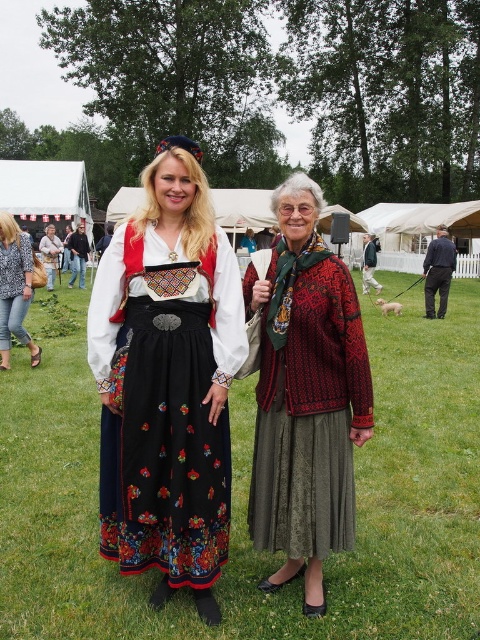
Question: Based on their relative distances, which object is nearer to the denim jeans at lower left?

Choices:
 (A) knitted sweater at center
 (B) matte black dress at center

Answer: (B)

Question: Which object is the farthest from the knitted wool sweater at center?

Choices:
 (A) knitted sweater at center
 (B) floral-patterned fabric dress at center
 (C) matte black skirt at center

Answer: (C)

Question: Is green grass at center closer to camera compared to knitted sweater at center?

Choices:
 (A) yes
 (B) no

Answer: (A)

Question: Which of the following is the closest to the observer?

Choices:
 (A) (46, 240)
 (B) (296, 484)
 (C) (396, 397)

Answer: (B)

Question: Observing the image, what is the correct spatial positioning of knitted wool sweater at center in reference to matte black dress at center?

Choices:
 (A) above
 (B) below

Answer: (B)

Question: In this image, where is floral-patterned fabric dress at center located relative to matte black skirt at center?

Choices:
 (A) left
 (B) right

Answer: (B)